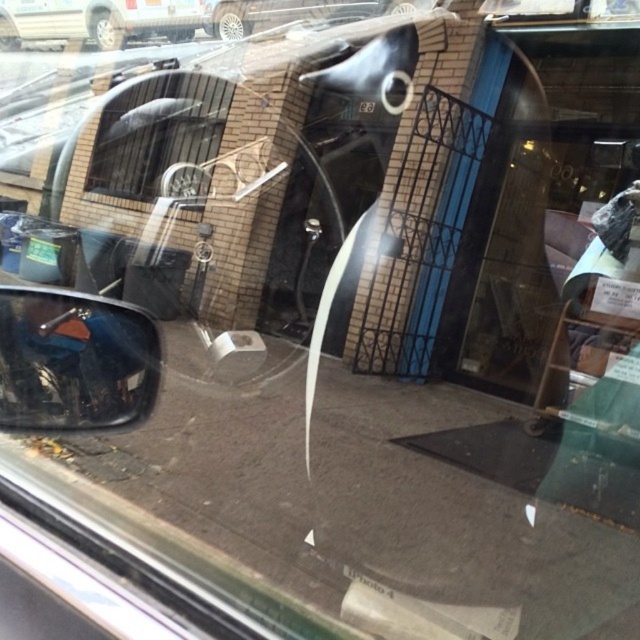
Consider the image. You are a passenger in a car and want to check the side mirror to see if there is any oncoming traffic before opening the door. Where exactly is the matte black view mirror at left located in the image?

The matte black view mirror at left is located at point coordinates of (74, 360).